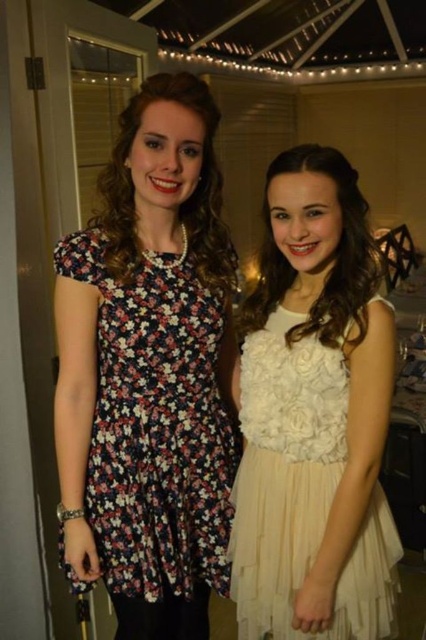
You are a photographer at a fashion show. You need to position the models wearing the floral print fabric dress at left and the ivory tulle dress at center so that they both fit within a 1.5 meter wide frame. Which dress should be placed closer to the edge of the frame to ensure both fit?

The floral print fabric dress at left has a larger width than the ivory tulle dress at center. To fit both within the 1.5 meter frame, place the wider floral print fabric dress at left closer to the center and the narrower ivory tulle dress at center near the edge, ensuring there is enough space for both.

You are at a social gathering in a sunroom with a high ceiling and string lights. You see a person wearing a floral print fabric dress at left. Where exactly is this dress positioned in the room?

The floral print fabric dress at left is positioned at coordinates point (157, 424).